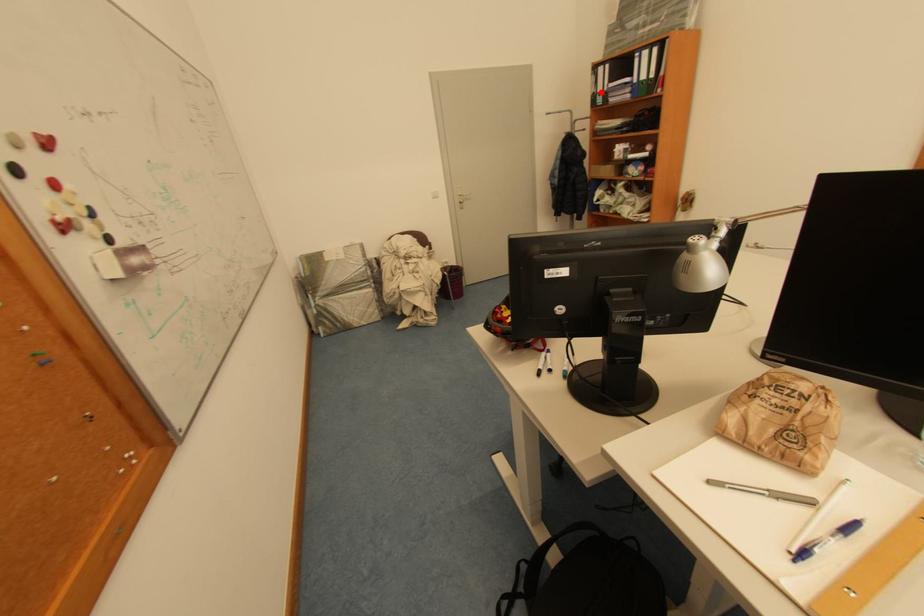
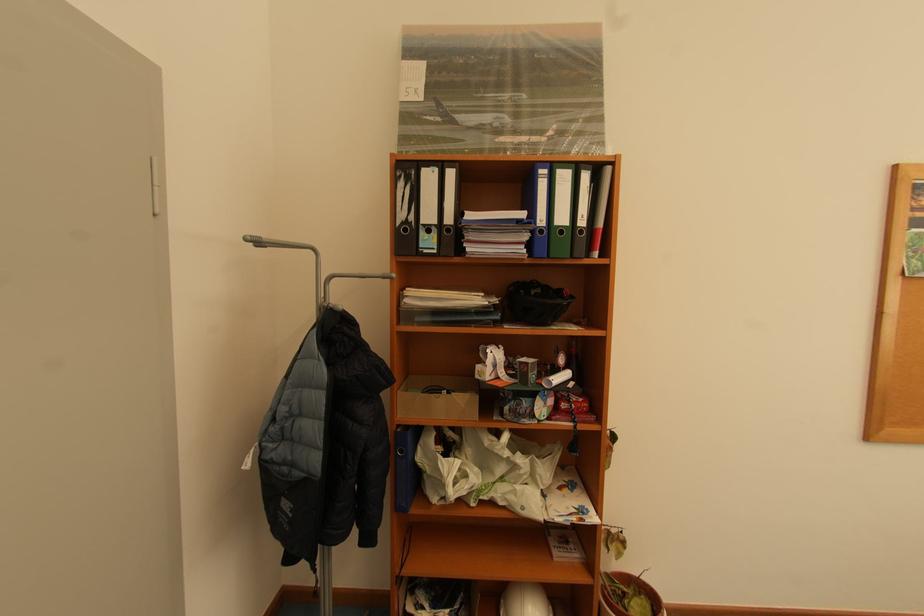
Locate, in the second image, the point that corresponds to the highlighted location in the first image.

(409, 217)